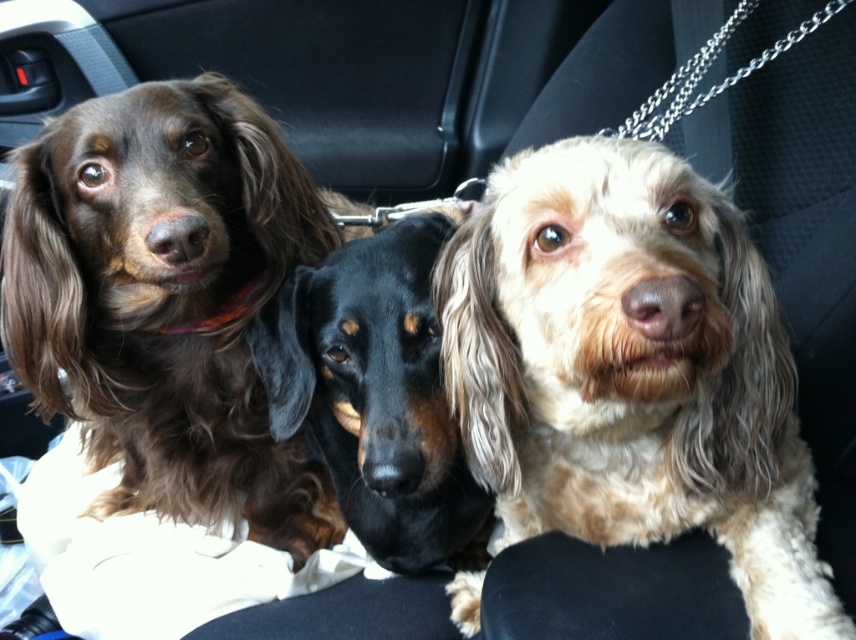
You are sitting in the backseat of a car and see three dogs. The dogs are the dog on the left with long dark brown fur and red collar, the middle dog with black and tan markings, and the light brown fur at center. Which dog is sitting exactly at the center of the backseat?

The light brown fur at center is sitting exactly at the center of the backseat as per the coordinates provided.

You are a dog owner who wants to place a small toy between the light brown fur at center and the black shiny coat at center. Which dog should you place the toy closer to in order to ensure it is within reach of both?

The toy should be placed closer to the light brown fur at center because it is taller than the black shiny coat at center, allowing both dogs to reach it easily.